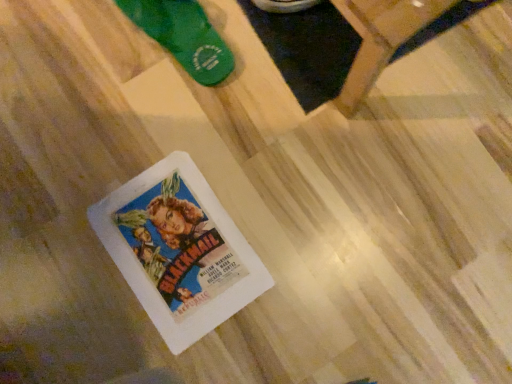
Locate an element on the screen. green rubber slipper at upper center is located at coordinates (183, 36).

Measure the distance between green rubber slipper at upper center and camera.

green rubber slipper at upper center is 30.45 inches away from camera.

Describe the element at coordinates (183, 36) in the screenshot. I see `green rubber slipper at upper center` at that location.

Identify the location of green rubber slipper at upper center. (183, 36).